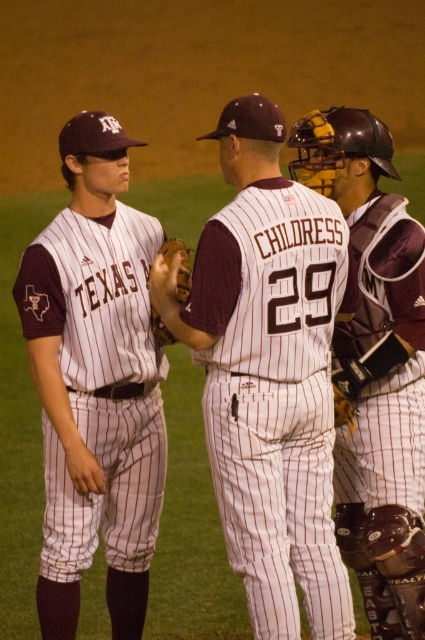
You are a photographer at the stadium and want to capture a photo of the white pinstriped uniform at center and the brown leather glove at center. Which object should you focus on first if you want to ensure both are in the frame without moving the camera?

The white pinstriped uniform at center is much taller than the brown leather glove at center, so you should focus on the white pinstriped uniform at center first to ensure it fits within the frame, then adjust for the smaller glove.

You are a photographer at the stadium and want to capture a closeup of the white pinstriped uniform at center and the brown leather glove at center. Based on their sizes, which object will appear larger in the photo?

The white pinstriped uniform at center will appear larger in the photo because its width surpasses that of the brown leather glove at center.

You are a photographer trying to capture the coach and the player in a way that both are clearly visible. You notice two points in the image at coordinates point (x=40, y=364) and point (x=337, y=432). Which point should you focus on to ensure both subjects are in focus?

You should focus on point (x=40, y=364) because it is closer to the viewer than point (x=337, y=432), allowing both subjects to be in focus when using a shallow depth of field.